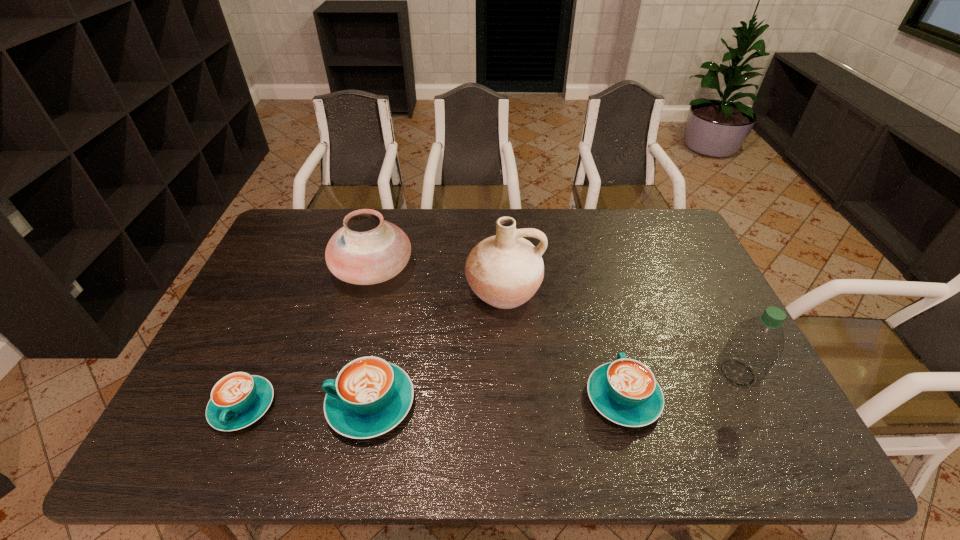
Find the location of a particular element. This screenshot has height=540, width=960. vacant area between the leftmost cappuccino and the water bottle is located at coordinates (491, 389).

This screenshot has height=540, width=960. In order to click on vacant area that lies between the second cappuccino from right to left and the water bottle in this screenshot , I will do `click(554, 388)`.

Locate an element on the screen. The width and height of the screenshot is (960, 540). free space that is in between the rightmost cappuccino and the rightmost object is located at coordinates (681, 385).

Locate an element on the screen. The height and width of the screenshot is (540, 960). free space that is in between the third object from right to left and the left pottery is located at coordinates (438, 280).

The height and width of the screenshot is (540, 960). What are the coordinates of `free area in between the rightmost object and the second shortest object` in the screenshot? It's located at (681, 385).

You are a GUI agent. You are given a task and a screenshot of the screen. Output one action in this format:
    pyautogui.click(x=<x>, y=<y>)
    Task: Click on the free spot between the second cappuccino from left to right and the rightmost object
    
    Given the screenshot: What is the action you would take?
    pyautogui.click(x=554, y=388)

Locate an element on the screen. vacant space that's between the leftmost object and the right pottery is located at coordinates (373, 348).

At what (x,y) coordinates should I click in order to perform the action: click on vacant area between the second tallest cappuccino and the rightmost object. Please return your answer as a coordinate pair (x, y). This screenshot has height=540, width=960. Looking at the image, I should click on (681, 385).

Locate an element on the screen. The width and height of the screenshot is (960, 540). empty location between the shortest cappuccino and the right pottery is located at coordinates (373, 348).

At what (x,y) coordinates should I click in order to perform the action: click on free space between the fourth object from left to right and the shortest cappuccino. Please return your answer as a coordinate pair (x, y). The width and height of the screenshot is (960, 540). Looking at the image, I should click on (373, 348).